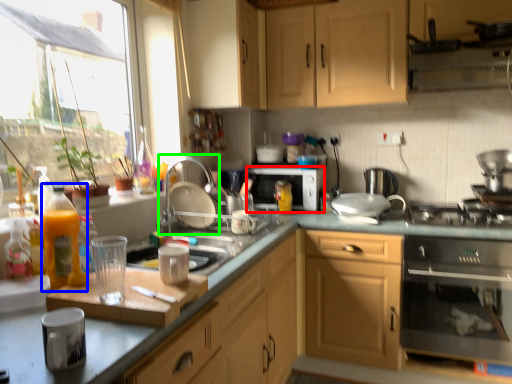
Question: Which object is positioned farthest from microwave oven (highlighted by a red box)? Select from bottle (highlighted by a blue box) and faucet (highlighted by a green box).

Choices:
 (A) bottle
 (B) faucet

Answer: (A)